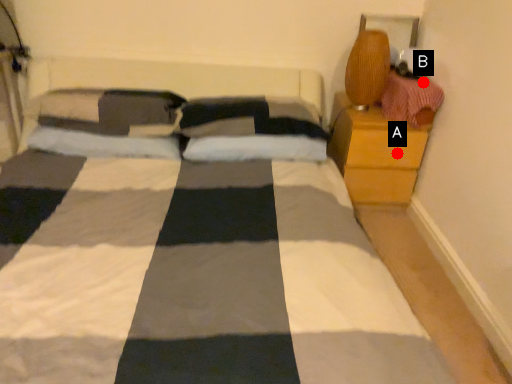
Question: Two points are circled on the image, labeled by A and B beside each circle. Which point is closer to the camera?

Choices:
 (A) A is closer
 (B) B is closer

Answer: (B)